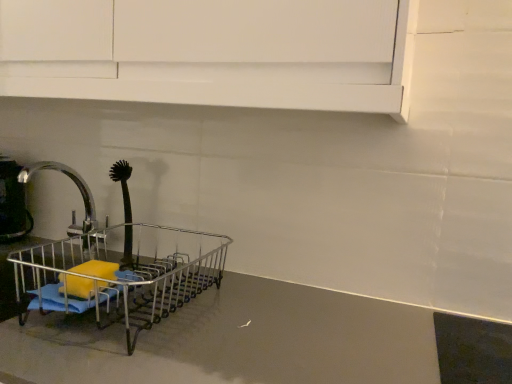
Question: Considering the relative positions of metallic gray counter top at center and silver metallic faucet at left in the image provided, is metallic gray counter top at center in front of silver metallic faucet at left?

Choices:
 (A) yes
 (B) no

Answer: (A)

Question: Is metallic gray counter top at center looking in the opposite direction of silver metallic faucet at left?

Choices:
 (A) yes
 (B) no

Answer: (B)

Question: Considering the relative sizes of metallic gray counter top at center and silver metallic faucet at left in the image provided, is metallic gray counter top at center wider than silver metallic faucet at left?

Choices:
 (A) yes
 (B) no

Answer: (A)

Question: Is metallic gray counter top at center shorter than silver metallic faucet at left?

Choices:
 (A) yes
 (B) no

Answer: (B)

Question: Is the depth of metallic gray counter top at center greater than that of silver metallic faucet at left?

Choices:
 (A) no
 (B) yes

Answer: (A)

Question: Is metallic gray counter top at center not within silver metallic faucet at left?

Choices:
 (A) no
 (B) yes

Answer: (B)

Question: Is metallic silver kettle at left positioned beyond the bounds of black rubber brush at left?

Choices:
 (A) no
 (B) yes

Answer: (B)

Question: Is metallic silver kettle at left positioned before black rubber brush at left?

Choices:
 (A) yes
 (B) no

Answer: (B)

Question: Does metallic silver kettle at left appear on the right side of black rubber brush at left?

Choices:
 (A) no
 (B) yes

Answer: (A)

Question: Is metallic silver kettle at left positioned with its back to black rubber brush at left?

Choices:
 (A) no
 (B) yes

Answer: (A)

Question: Can you confirm if metallic silver kettle at left is bigger than black rubber brush at left?

Choices:
 (A) no
 (B) yes

Answer: (B)

Question: Is metallic silver kettle at left aimed at black rubber brush at left?

Choices:
 (A) yes
 (B) no

Answer: (B)

Question: From a real-world perspective, is silver metallic faucet at left positioned over black rubber brush at left based on gravity?

Choices:
 (A) no
 (B) yes

Answer: (A)